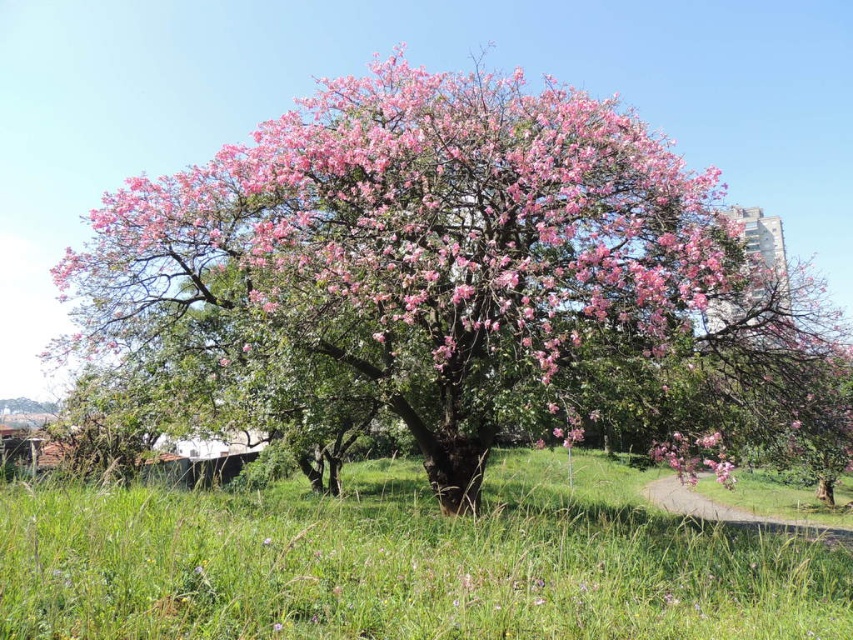
What do you see at coordinates (462, 282) in the screenshot?
I see `pink blossoming tree at center` at bounding box center [462, 282].

Which is in front, point (433, 93) or point (527, 458)?

Point (433, 93)

What do you see at coordinates (462, 282) in the screenshot? This screenshot has height=640, width=853. I see `pink blossoming tree at center` at bounding box center [462, 282].

What are the coordinates of `pink blossoming tree at center` in the screenshot? It's located at (462, 282).